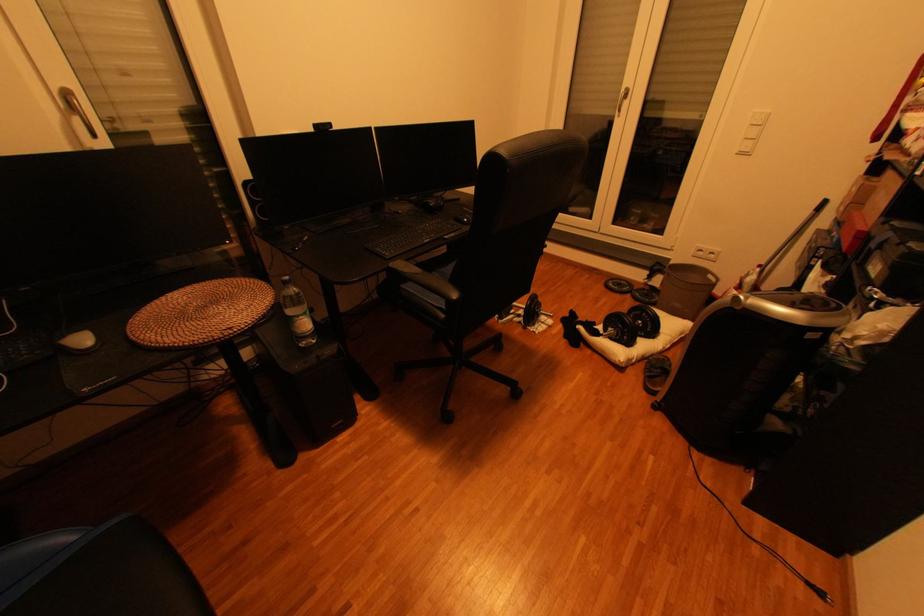
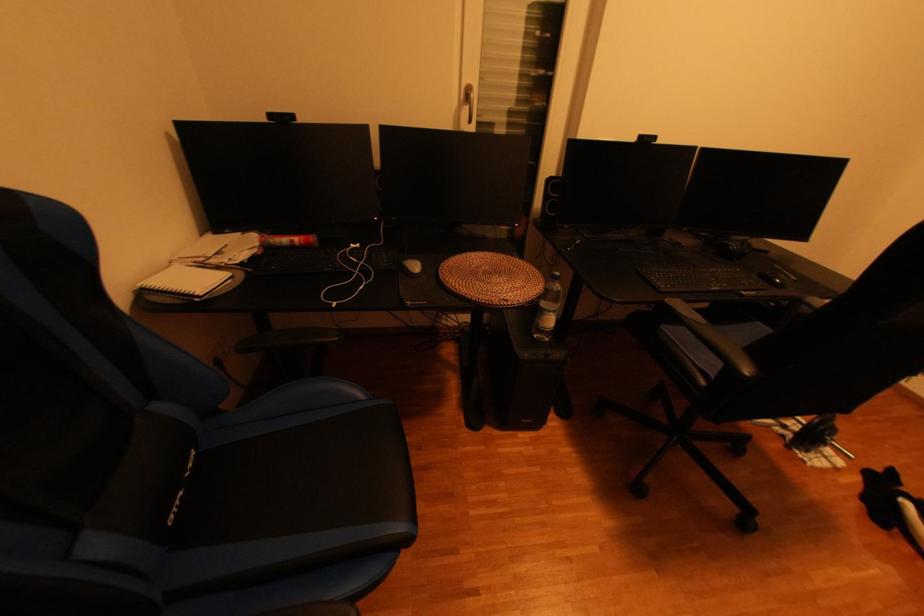
Locate, in the second image, the point that corresponds to point 400,265 in the first image.

(677, 302)